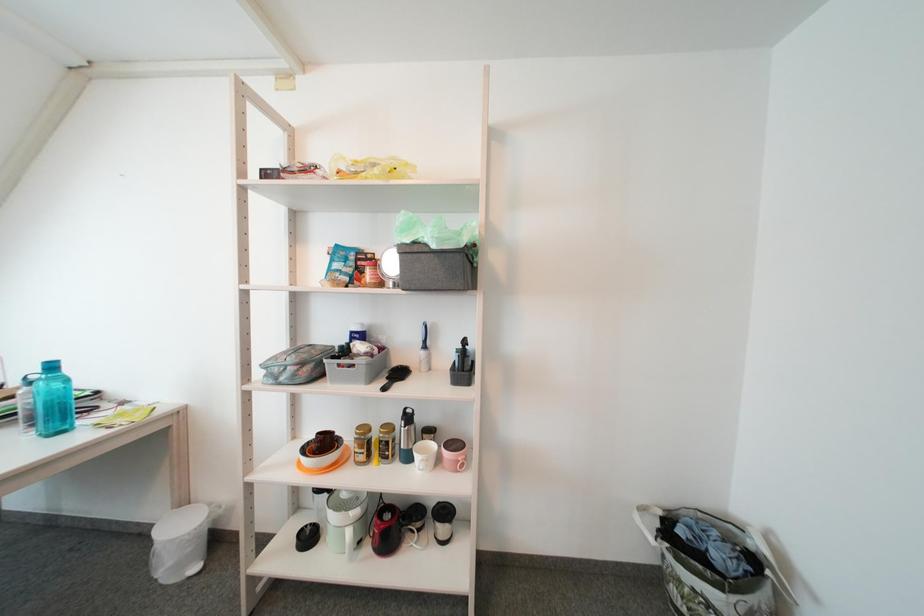
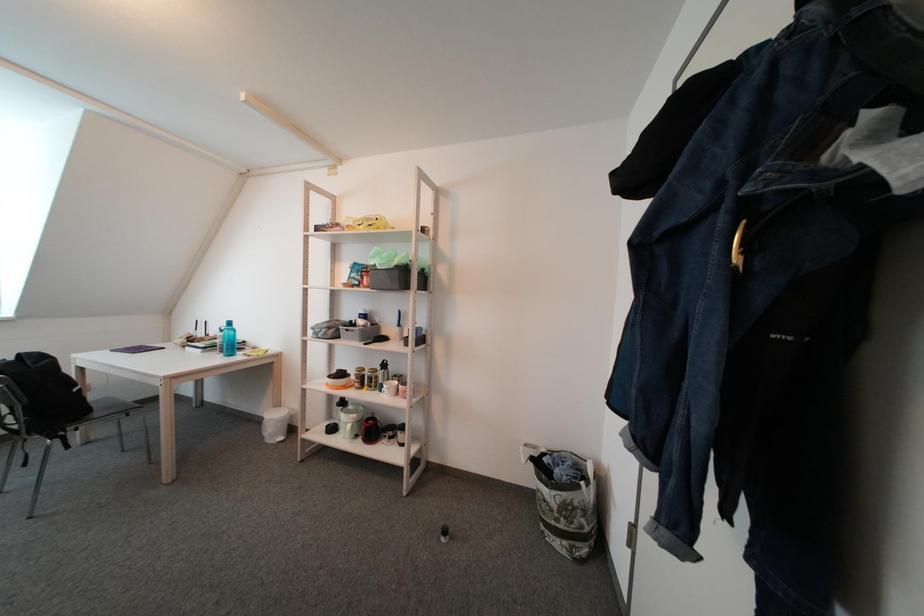
In a continuous first-person perspective shot, in which direction is the camera moving?

The cameraman walked toward right, backward.